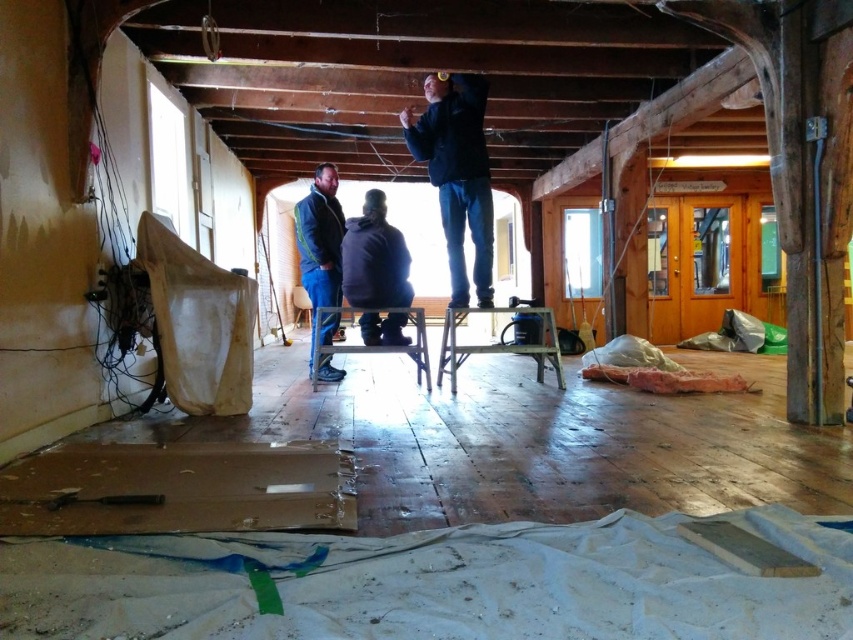
Question: Is dark blue jacket at upper center further to the viewer compared to blue denim jacket at center?

Choices:
 (A) no
 (B) yes

Answer: (A)

Question: Does dark blue jacket at upper center appear on the right side of blue denim jacket at center?

Choices:
 (A) yes
 (B) no

Answer: (A)

Question: Among these points, which one is farthest from the camera?

Choices:
 (A) (437, 81)
 (B) (306, 268)

Answer: (B)

Question: Which point is farther from the camera taking this photo?

Choices:
 (A) (490, 284)
 (B) (328, 177)

Answer: (B)

Question: Is dark blue jacket at upper center thinner than blue denim jacket at center?

Choices:
 (A) yes
 (B) no

Answer: (B)